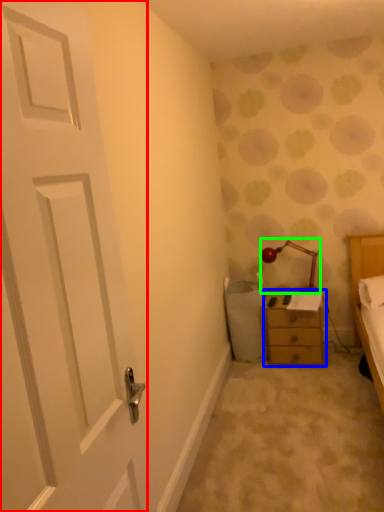
Question: Which is nearer to the door (highlighted by a red box)? chest of drawers (highlighted by a blue box) or lamp (highlighted by a green box).

Choices:
 (A) chest of drawers
 (B) lamp

Answer: (A)